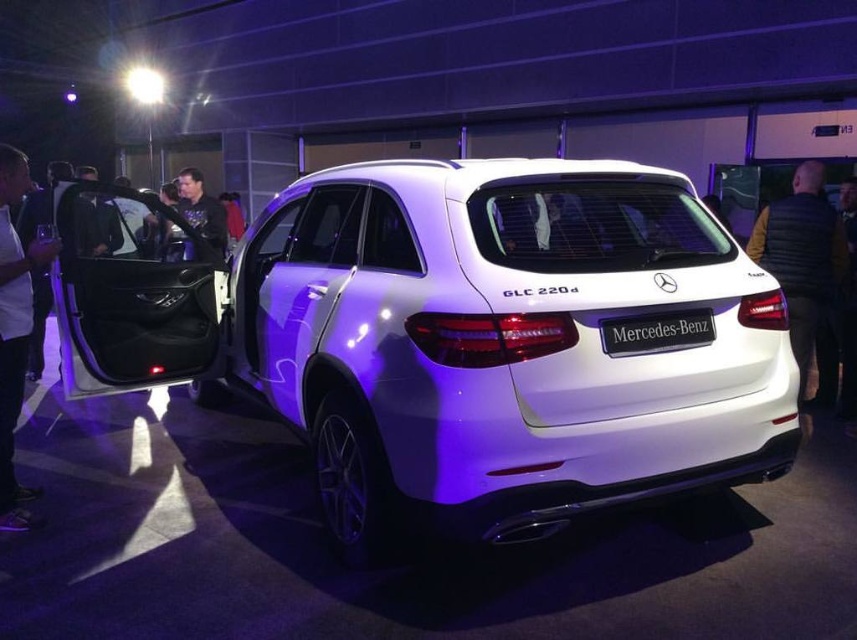
You are standing in the showroom and see the white glossy suv at center and the white shirt at left. Which object is positioned further to the right?

The white glossy suv at center is positioned further to the right than the white shirt at left.

You are a photographer at the car event. You need to capture a photo of the white glossy suv at center and the black quilted vest at rear. Based on their positions, which object is positioned lower in the image?

The white glossy suv at center is located below the black quilted vest at rear, so the white glossy suv at center is positioned lower in the image.